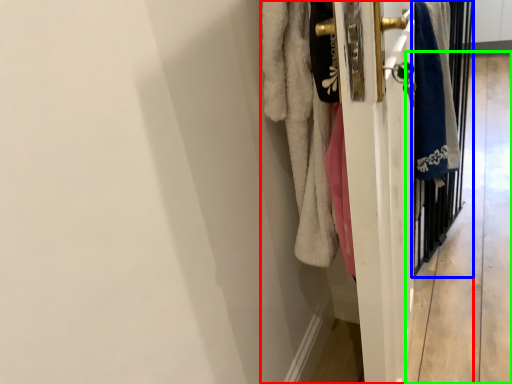
Question: Based on their relative distances, which object is nearer to closet (highlighted by a red box)? Choose from screen door (highlighted by a blue box) and corridor (highlighted by a green box).

Choices:
 (A) screen door
 (B) corridor

Answer: (A)